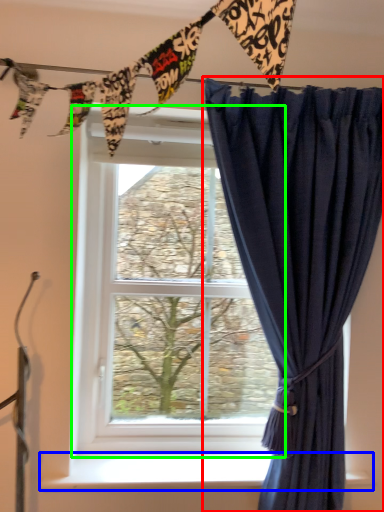
Question: Considering the real-world distances, which object is farthest from curtain (highlighted by a red box)? window sill (highlighted by a blue box) or window (highlighted by a green box)?

Choices:
 (A) window sill
 (B) window

Answer: (A)